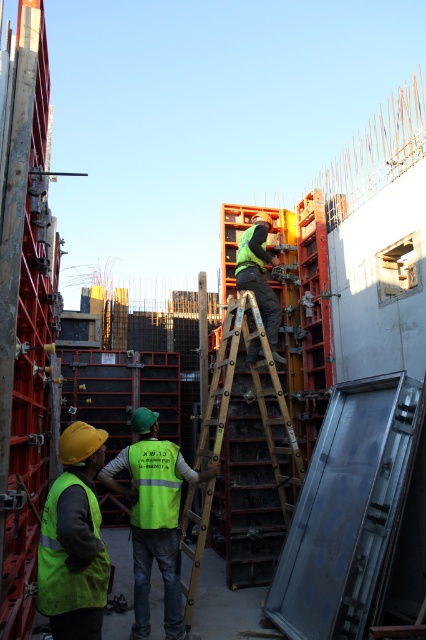
You are a safety inspector checking equipment dimensions. You need to ensure that the yellow hard hat at lower left and the green reflective vest at center meet the minimum width requirements. Which item has a smaller width?

The yellow hard hat at lower left has a lesser width compared to the green reflective vest at center, so the yellow hard hat at lower left is smaller in width.